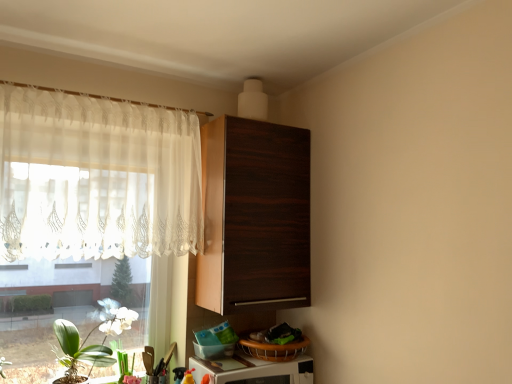
Question: Is the surface of green matte plant at lower left in direct contact with white glossy microwave at lower center?

Choices:
 (A) no
 (B) yes

Answer: (A)

Question: Is white glossy microwave at lower center inside green matte plant at lower left?

Choices:
 (A) no
 (B) yes

Answer: (A)

Question: Does green matte plant at lower left lie in front of white glossy microwave at lower center?

Choices:
 (A) no
 (B) yes

Answer: (A)

Question: Are green matte plant at lower left and white glossy microwave at lower center far apart?

Choices:
 (A) no
 (B) yes

Answer: (A)

Question: Can you confirm if green matte plant at lower left is bigger than white glossy microwave at lower center?

Choices:
 (A) yes
 (B) no

Answer: (B)

Question: Considering the relative sizes of green matte plant at lower left and white glossy microwave at lower center in the image provided, is green matte plant at lower left shorter than white glossy microwave at lower center?

Choices:
 (A) no
 (B) yes

Answer: (A)

Question: Is sheer white curtain at left thinner than green matte plant at lower left?

Choices:
 (A) yes
 (B) no

Answer: (A)

Question: Can we say sheer white curtain at left lies outside green matte plant at lower left?

Choices:
 (A) no
 (B) yes

Answer: (B)

Question: Considering the relative sizes of sheer white curtain at left and green matte plant at lower left in the image provided, is sheer white curtain at left smaller than green matte plant at lower left?

Choices:
 (A) yes
 (B) no

Answer: (B)

Question: Is sheer white curtain at left shorter than green matte plant at lower left?

Choices:
 (A) no
 (B) yes

Answer: (A)

Question: Can you see sheer white curtain at left touching green matte plant at lower left?

Choices:
 (A) yes
 (B) no

Answer: (B)

Question: Is sheer white curtain at left at the left side of green matte plant at lower left?

Choices:
 (A) no
 (B) yes

Answer: (B)

Question: Is green leafy plant at lower left to the right of white glossy microwave at lower center from the viewer's perspective?

Choices:
 (A) no
 (B) yes

Answer: (A)